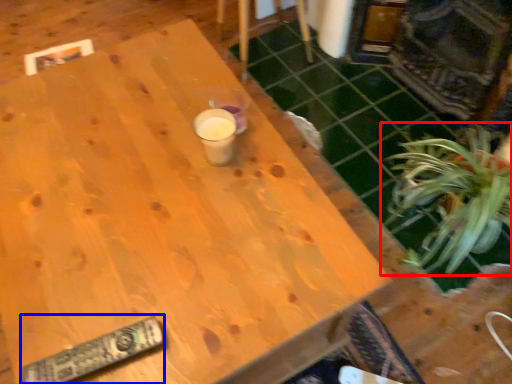
Question: Among these objects, which one is farthest to the camera, houseplant (highlighted by a red box) or remote (highlighted by a blue box)?

Choices:
 (A) houseplant
 (B) remote

Answer: (A)